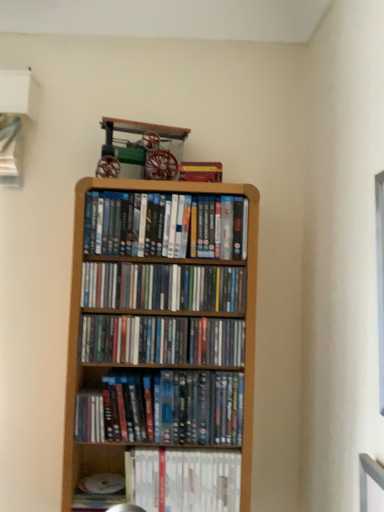
Question: Would you say wooden shelf at center, the 4th book positioned from the bottom, is outside white glossy book at lower center, the 5th book positioned from the top?

Choices:
 (A) yes
 (B) no

Answer: (A)

Question: Does wooden shelf at center, arranged as the second book when viewed from the top, appear on the left side of white glossy book at lower center, the 5th book positioned from the top?

Choices:
 (A) yes
 (B) no

Answer: (A)

Question: From a real-world perspective, is wooden shelf at center, the 4th book positioned from the bottom, located higher than white glossy book at lower center, the first book from the bottom?

Choices:
 (A) no
 (B) yes

Answer: (B)

Question: Is wooden shelf at center, arranged as the second book when viewed from the top, positioned before white glossy book at lower center, the 5th book positioned from the top?

Choices:
 (A) yes
 (B) no

Answer: (A)

Question: Is wooden shelf at center, the 4th book positioned from the bottom, oriented away from white glossy book at lower center, the 5th book positioned from the top?

Choices:
 (A) yes
 (B) no

Answer: (B)

Question: Does wooden shelf at center, the 4th book positioned from the bottom, have a larger size compared to white glossy book at lower center, the first book from the bottom?

Choices:
 (A) no
 (B) yes

Answer: (A)

Question: Is matte plastic books at center, which is the 2th book from bottom to top, positioned far away from matte plastic dvds at center, which is counted as the 1th book, starting from the top?

Choices:
 (A) yes
 (B) no

Answer: (B)

Question: Can you confirm if matte plastic books at center, which is the 2th book from bottom to top, is wider than matte plastic dvds at center, which is counted as the 1th book, starting from the top?

Choices:
 (A) yes
 (B) no

Answer: (B)

Question: Does matte plastic books at center, which is the 4th book in top-to-bottom order, appear on the right side of matte plastic dvds at center, which is counted as the 1th book, starting from the top?

Choices:
 (A) no
 (B) yes

Answer: (A)

Question: From a real-world perspective, is matte plastic books at center, which is the 4th book in top-to-bottom order, on matte plastic dvds at center, which is counted as the 5th book, starting from the bottom?

Choices:
 (A) no
 (B) yes

Answer: (A)

Question: From the image's perspective, is matte plastic books at center, which is the 2th book from bottom to top, under matte plastic dvds at center, which is counted as the 5th book, starting from the bottom?

Choices:
 (A) no
 (B) yes

Answer: (B)

Question: Considering the relative sizes of matte plastic books at center, which is the 2th book from bottom to top, and matte plastic dvds at center, which is counted as the 1th book, starting from the top, in the image provided, is matte plastic books at center, which is the 2th book from bottom to top, bigger than matte plastic dvds at center, which is counted as the 1th book, starting from the top,?

Choices:
 (A) yes
 (B) no

Answer: (B)

Question: Is matte plastic dvds at center, which is counted as the 1th book, starting from the top, aimed at wooden shelf at center, arranged as the second book when viewed from the top?

Choices:
 (A) yes
 (B) no

Answer: (B)